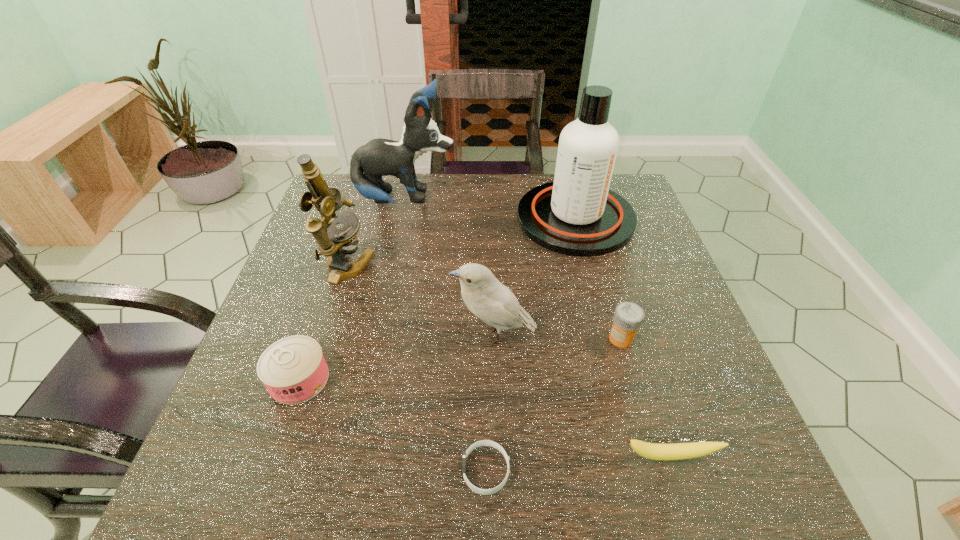
Locate an element on the screen. The height and width of the screenshot is (540, 960). vacant point located between the banana and the shortest object is located at coordinates (578, 463).

Identify which object is the third nearest to the wristband. Please provide its 2D coordinates. Your answer should be formatted as a tuple, i.e. [(x, y)], where the tuple contains the x and y coordinates of a point satisfying the conditions above.

[(293, 369)]

Image resolution: width=960 pixels, height=540 pixels. I want to click on object that is the seventh closest to the microscope, so click(x=661, y=452).

You are a GUI agent. You are given a task and a screenshot of the screen. Output one action in this format:
    pyautogui.click(x=<x>, y=<y>)
    Task: Click on the blank space that satisfies the following two spatial constraints: 1. on the upward curve of the banana; 2. on the outer surface of the shortest object
    This screenshot has height=540, width=960.
    Given the screenshot: What is the action you would take?
    pyautogui.click(x=674, y=470)

At what (x,y) coordinates should I click in order to perform the action: click on free space that satisfies the following two spatial constraints: 1. on the label side of the fourth shortest object; 2. on the front side of the third nearest object. Please return your answer as a coordinate pair (x, y). This screenshot has width=960, height=540. Looking at the image, I should click on (633, 379).

Locate an element on the screen. vacant space that satisfies the following two spatial constraints: 1. on the upward curve of the banana; 2. on the outer surface of the shortest object is located at coordinates (674, 470).

Where is `free space that satisfies the following two spatial constraints: 1. on the front-facing side of the puppy; 2. on the back side of the cleansing agent`? This screenshot has height=540, width=960. free space that satisfies the following two spatial constraints: 1. on the front-facing side of the puppy; 2. on the back side of the cleansing agent is located at coordinates (402, 218).